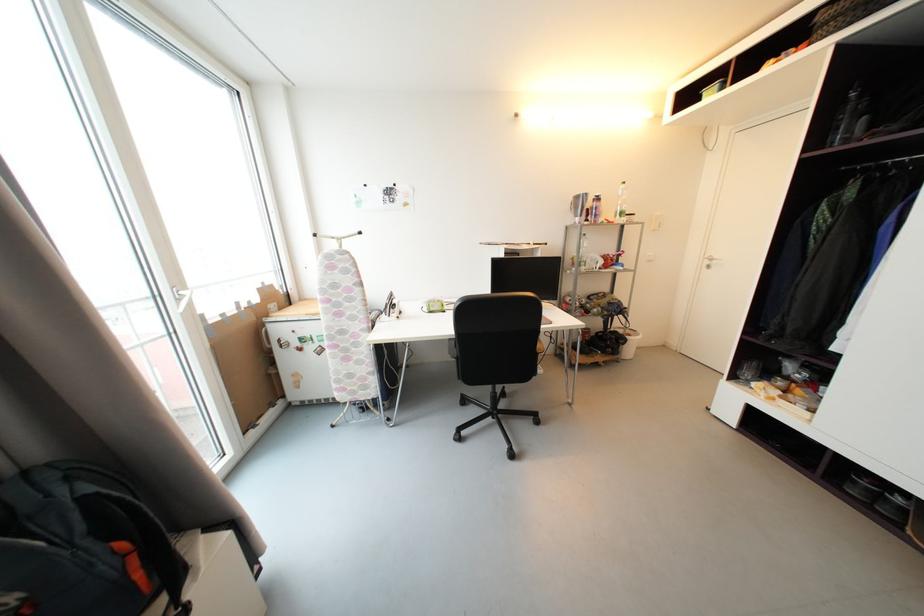
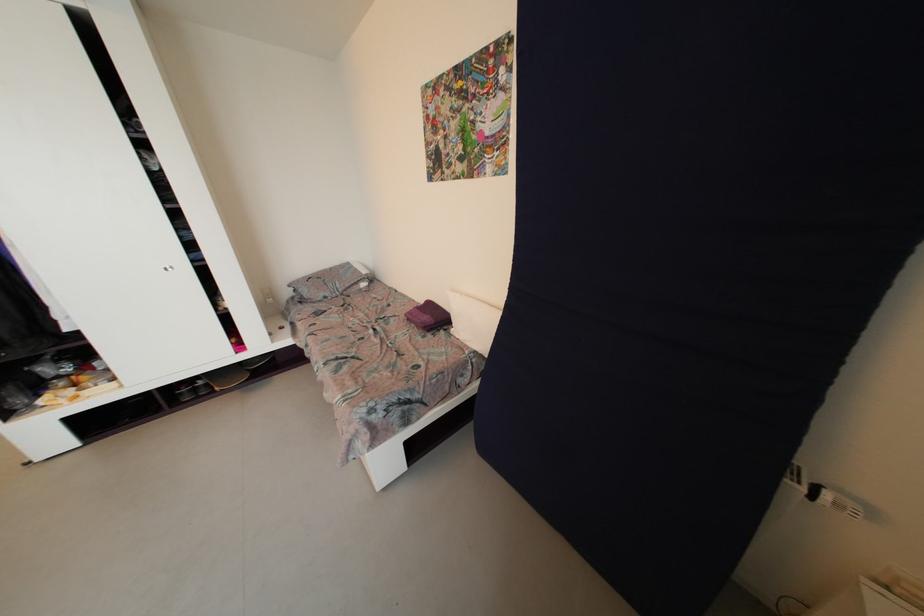
Find the pixel in the second image that matches (x=854, y=468) in the first image.

(175, 391)